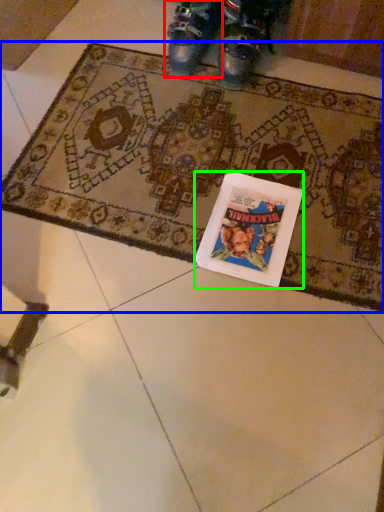
Question: Which object is positioned farthest from footwear (highlighted by a red box)? Select from mat (highlighted by a blue box) and book cover (highlighted by a green box).

Choices:
 (A) mat
 (B) book cover

Answer: (B)